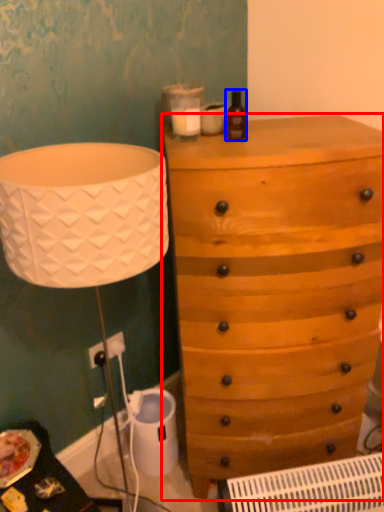
Question: Among these objects, which one is farthest to the camera, chest of drawers (highlighted by a red box) or bottle (highlighted by a blue box)?

Choices:
 (A) chest of drawers
 (B) bottle

Answer: (B)